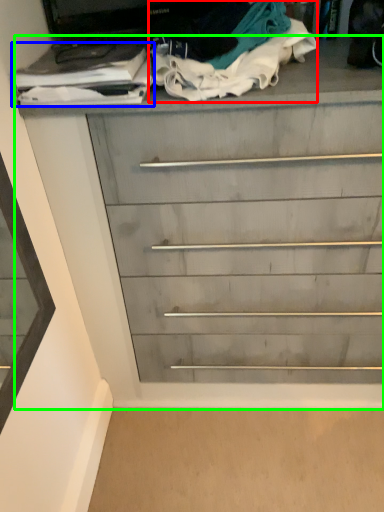
Question: Considering the real-world distances, which object is farthest from clothing (highlighted by a red box)? clothing (highlighted by a blue box) or chest of drawers (highlighted by a green box)?

Choices:
 (A) clothing
 (B) chest of drawers

Answer: (B)